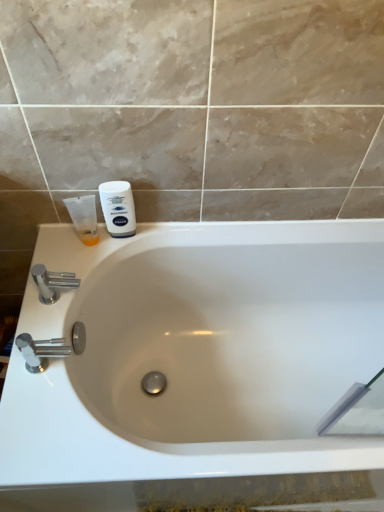
Locate an element on the screen. vacant region in front of chrome metallic faucet at left, the second tap viewed from the front is located at coordinates (40, 359).